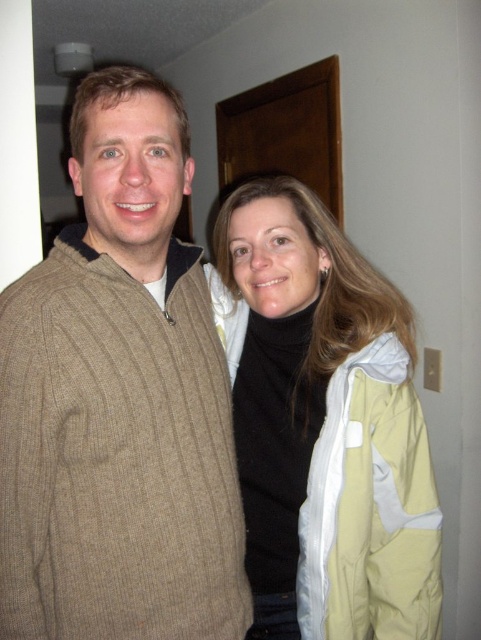
You are a tailor measuring garments for alterations. You have a tailor dummy that can only accommodate items up to 1 meter in width. You need to determine if both the knit sweater at left and the light yellow jacket at center can fit on the dummy. Which garment will fit and which will not?

The knit sweater at left has a width less than the light yellow jacket at center. Since the tailor dummy can hold up to 1 meter, the knit sweater at left will fit, but the light yellow jacket at center may exceed the width limit and not fit.

You are a tailor who needs to place both the knit sweater at left and the light yellow jacket at center into a storage box. The box can only hold one layer of clothing. Which item should you place first to ensure both fit properly?

The knit sweater at left is positioned over the light yellow jacket at center, so you should place the light yellow jacket at center first into the storage box, then the knit sweater at left on top to ensure both fit properly.